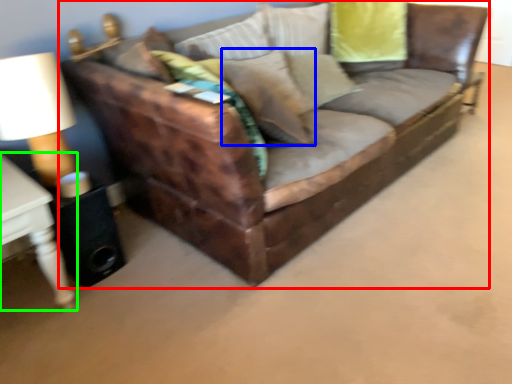
Question: Estimate the real-world distances between objects in this image. Which object is farther from studio couch (highlighted by a red box), pillow (highlighted by a blue box) or table (highlighted by a green box)?

Choices:
 (A) pillow
 (B) table

Answer: (B)